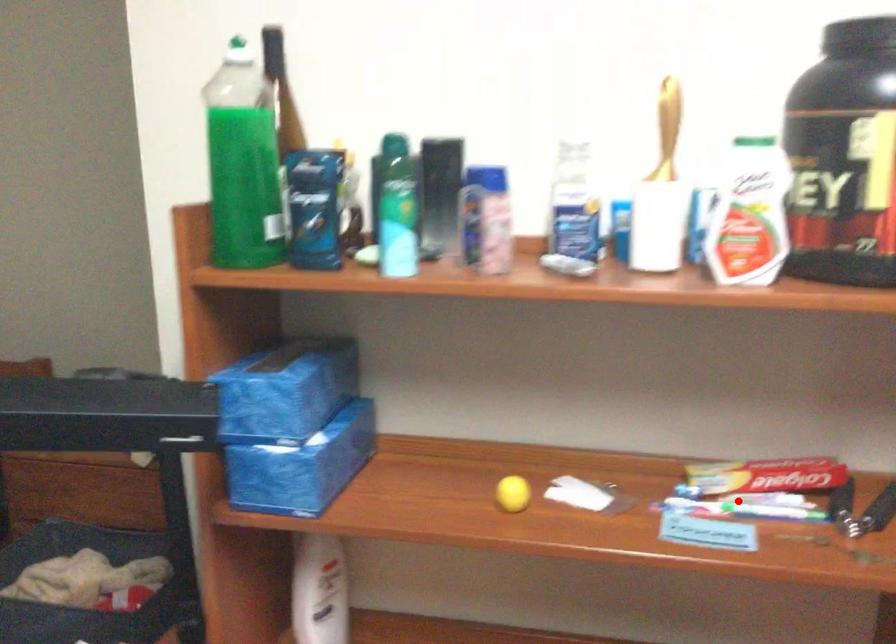
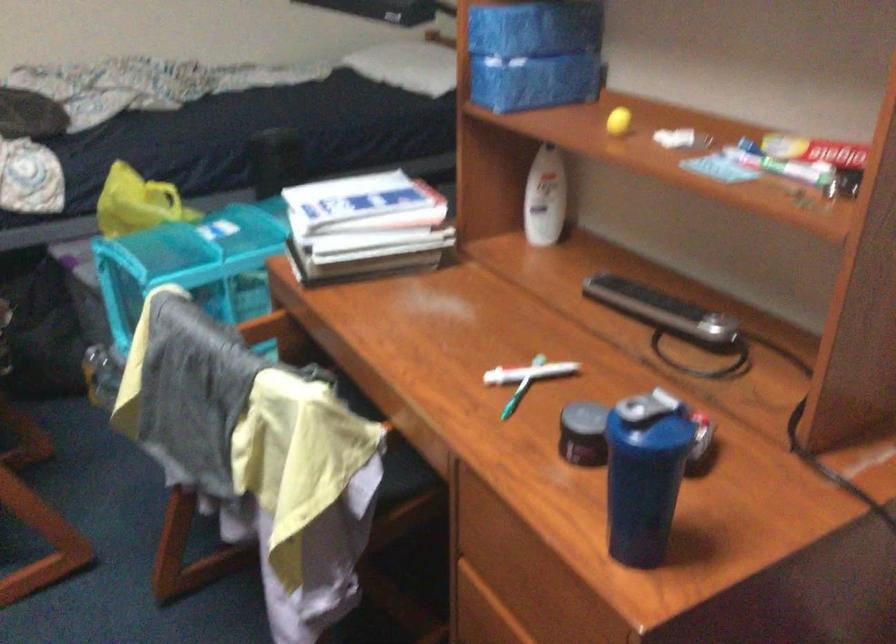
Question: I am providing you with two images of the same scene from different viewpoints. Image1 has a red point marked. In image2, the corresponding 3D location appears at what relative position? Reply with the corresponding letter.

Choices:
 (A) Closer
 (B) Farther

Answer: (B)